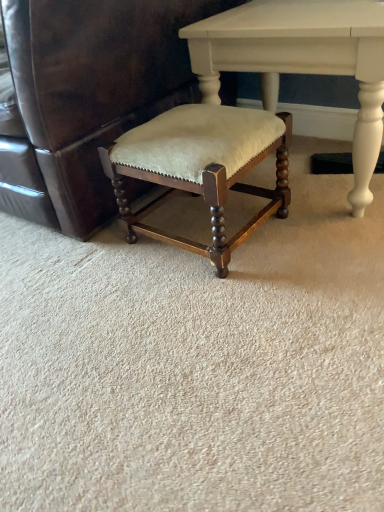
I want to click on free space between velvet beige stool at center and matte white table at center, so click(x=295, y=242).